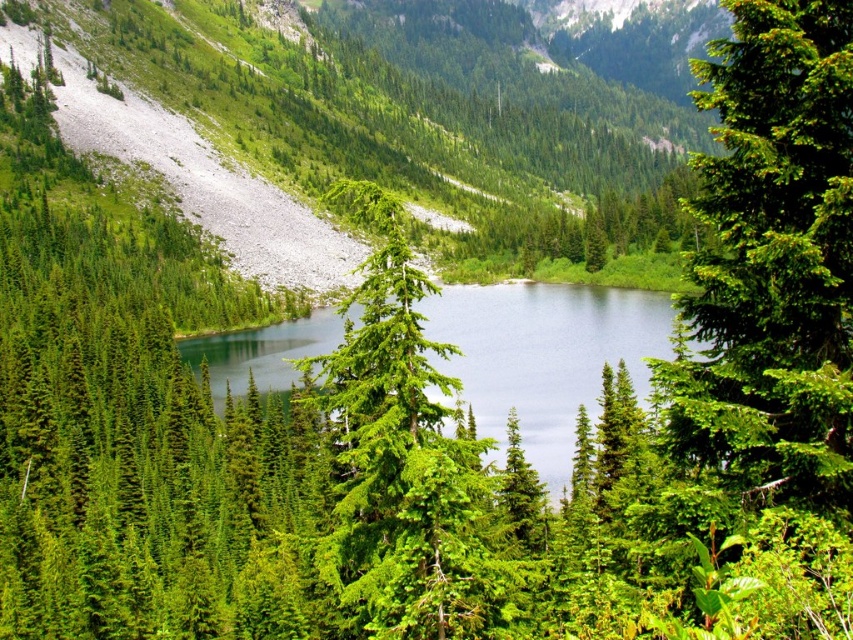
Between point (822, 451) and point (473, 397), which one is positioned in front?

Positioned in front is point (822, 451).

Which of these two, green matte evergreen tree at upper right or clear blue water at center, stands taller?

With more height is green matte evergreen tree at upper right.

Measure the distance between green matte evergreen tree at upper right and camera.

green matte evergreen tree at upper right is 17.50 meters from camera.

Locate an element on the screen. This screenshot has width=853, height=640. green matte evergreen tree at upper right is located at coordinates (773, 259).